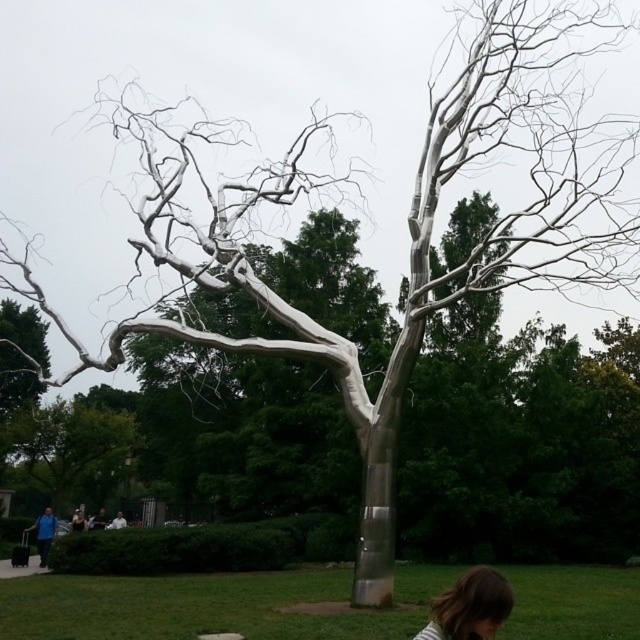
You are standing in the park and see the silver metallic tree at center and the blue fabric person at lower left. Which object is higher up in the image?

The silver metallic tree at center is located above the blue fabric person at lower left, so it is higher up in the image.

You are standing in a park and see the silver metallic tree at center and the dark brown hair at lower right. Which object is positioned to the left?

The silver metallic tree at center is positioned to the left of the dark brown hair at lower right.

You are standing in the park and see the silver metallic tree at center and the blue fabric person at lower left. Which object is positioned to the east of the other?

The silver metallic tree at center is to the right of blue fabric person at lower left, so the silver metallic tree at center is positioned to the east of the blue fabric person at lower left.